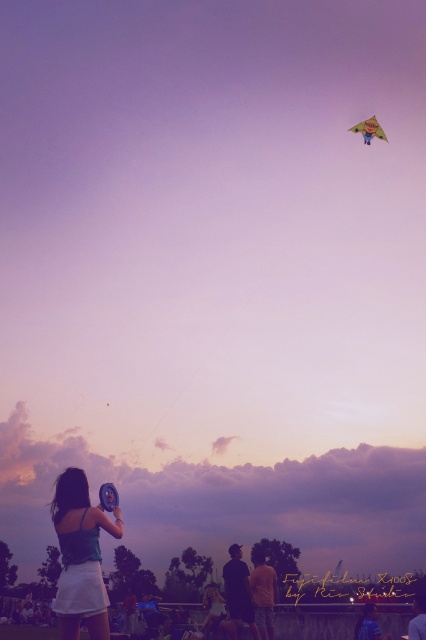
Question: Among these objects, which one is nearest to the camera?

Choices:
 (A) yellow fabric kite at upper center
 (B) matte teal tank top at lower left

Answer: (B)

Question: Observing the image, what is the correct spatial positioning of matte teal tank top at lower left in reference to yellow fabric kite at upper center?

Choices:
 (A) below
 (B) above

Answer: (A)

Question: Is matte teal tank top at lower left smaller than yellow fabric kite at upper center?

Choices:
 (A) yes
 (B) no

Answer: (A)

Question: Which of the following is the farthest from the observer?

Choices:
 (A) yellow fabric kite at upper center
 (B) matte teal tank top at lower left

Answer: (A)

Question: Can you confirm if matte teal tank top at lower left is smaller than yellow fabric kite at upper center?

Choices:
 (A) no
 (B) yes

Answer: (B)